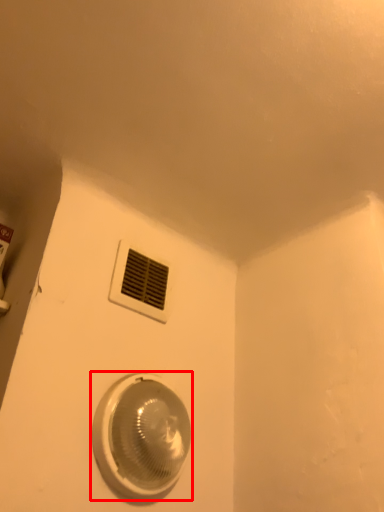
Question: From the image's perspective, where is home appliance (annotated by the red box) located relative to window?

Choices:
 (A) above
 (B) below

Answer: (B)